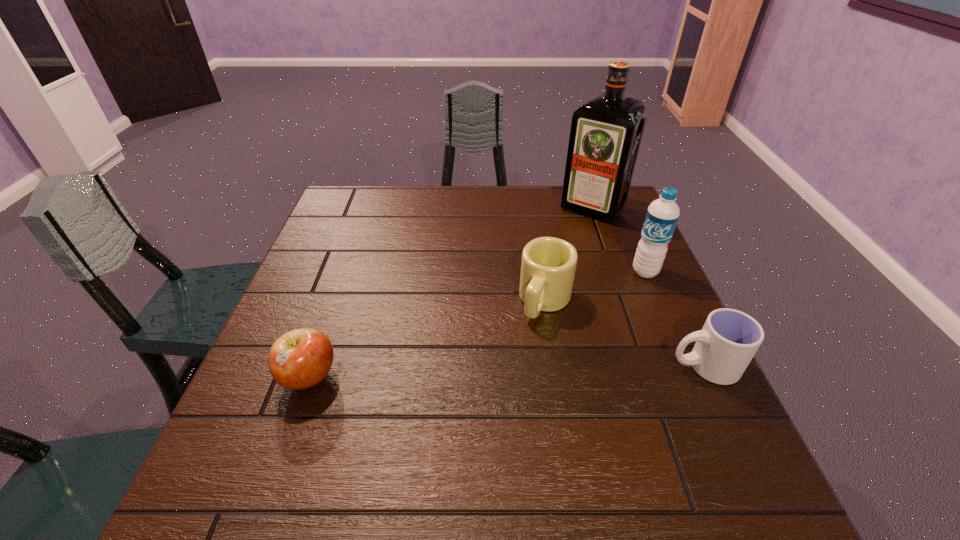
At what (x,y) coordinates should I click in order to perform the action: click on object that is the closest to the cup. Please return your answer as a coordinate pair (x, y). The image size is (960, 540). Looking at the image, I should click on (548, 265).

The width and height of the screenshot is (960, 540). I want to click on free space that satisfies the following two spatial constraints: 1. on the back side of the apple; 2. with the handle on the side of the cup, so click(313, 366).

I want to click on free location that satisfies the following two spatial constraints: 1. on the back side of the second object from left to right; 2. on the left side of the liquor, so click(x=531, y=208).

At what (x,y) coordinates should I click in order to perform the action: click on free region that satisfies the following two spatial constraints: 1. on the back side of the leftmost object; 2. with the handle on the side of the cup. Please return your answer as a coordinate pair (x, y). The height and width of the screenshot is (540, 960). Looking at the image, I should click on (313, 366).